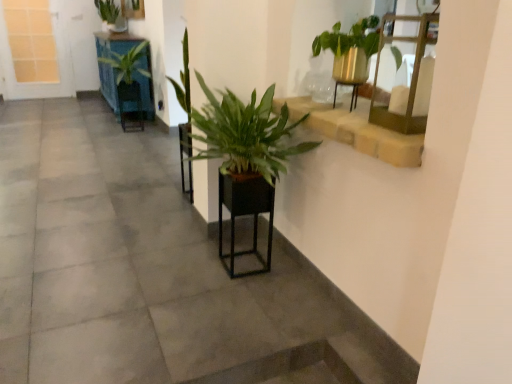
Question: Is green leafy plant at upper left, arranged as the third houseplant when ordered from the bottom, smaller than black matte planter at center, which ranks as the first armchair in right-to-left order?

Choices:
 (A) no
 (B) yes

Answer: (A)

Question: Is green leafy plant at upper left, arranged as the third houseplant when ordered from the bottom, oriented away from black matte planter at center, which ranks as the first armchair in right-to-left order?

Choices:
 (A) no
 (B) yes

Answer: (A)

Question: Can black matte planter at center, the 3th armchair positioned from the back, be found inside green leafy plant at upper left, which is counted as the third houseplant, starting from the right?

Choices:
 (A) no
 (B) yes

Answer: (A)

Question: Considering the relative sizes of green leafy plant at upper left, the third houseplant in the front-to-back sequence, and black matte planter at center, placed as the first armchair when sorted from bottom to top, in the image provided, is green leafy plant at upper left, the third houseplant in the front-to-back sequence, taller than black matte planter at center, placed as the first armchair when sorted from bottom to top,?

Choices:
 (A) no
 (B) yes

Answer: (A)

Question: Does green leafy plant at upper left, marked as the 1th houseplant in a top-to-bottom arrangement, come behind black matte planter at center, the 3th armchair positioned from the back?

Choices:
 (A) yes
 (B) no

Answer: (A)

Question: From a real-world perspective, is black matte planter at center, marked as the third armchair in a left-to-right arrangement, positioned above or below stone textured window sill at upper right?

Choices:
 (A) below
 (B) above

Answer: (A)

Question: Considering the positions of black matte planter at center, marked as the third armchair in a left-to-right arrangement, and stone textured window sill at upper right in the image, is black matte planter at center, marked as the third armchair in a left-to-right arrangement, taller or shorter than stone textured window sill at upper right?

Choices:
 (A) tall
 (B) short

Answer: (A)

Question: Considering the positions of point (221, 238) and point (373, 142), is point (221, 238) closer or farther from the camera than point (373, 142)?

Choices:
 (A) farther
 (B) closer

Answer: (A)

Question: Visually, is black matte planter at center, which ranks as the first armchair in right-to-left order, positioned to the left or to the right of stone textured window sill at upper right?

Choices:
 (A) right
 (B) left

Answer: (B)

Question: In terms of height, does green leafy plant at upper left, the third houseplant in the front-to-back sequence, look taller or shorter compared to gold metallic shelf at upper right?

Choices:
 (A) tall
 (B) short

Answer: (A)

Question: In the image, is green leafy plant at upper left, the third houseplant in the front-to-back sequence, positioned in front of or behind gold metallic shelf at upper right?

Choices:
 (A) front
 (B) behind

Answer: (B)

Question: Considering the relative positions of green leafy plant at upper left, acting as the first houseplant starting from the left, and gold metallic shelf at upper right in the image provided, is green leafy plant at upper left, acting as the first houseplant starting from the left, to the left or to the right of gold metallic shelf at upper right?

Choices:
 (A) left
 (B) right

Answer: (A)

Question: From a real-world perspective, is green leafy plant at upper left, which appears as the 1th houseplant when viewed from the back, positioned above or below gold metallic shelf at upper right?

Choices:
 (A) below
 (B) above

Answer: (B)

Question: Considering the positions of point (117, 23) and point (181, 122), is point (117, 23) closer or farther from the camera than point (181, 122)?

Choices:
 (A) closer
 (B) farther

Answer: (B)

Question: From the image's perspective, is green leafy plant at upper left, arranged as the third houseplant when ordered from the bottom, located above or below green matte plant at center, the 2th armchair when ordered from top to bottom?

Choices:
 (A) above
 (B) below

Answer: (A)